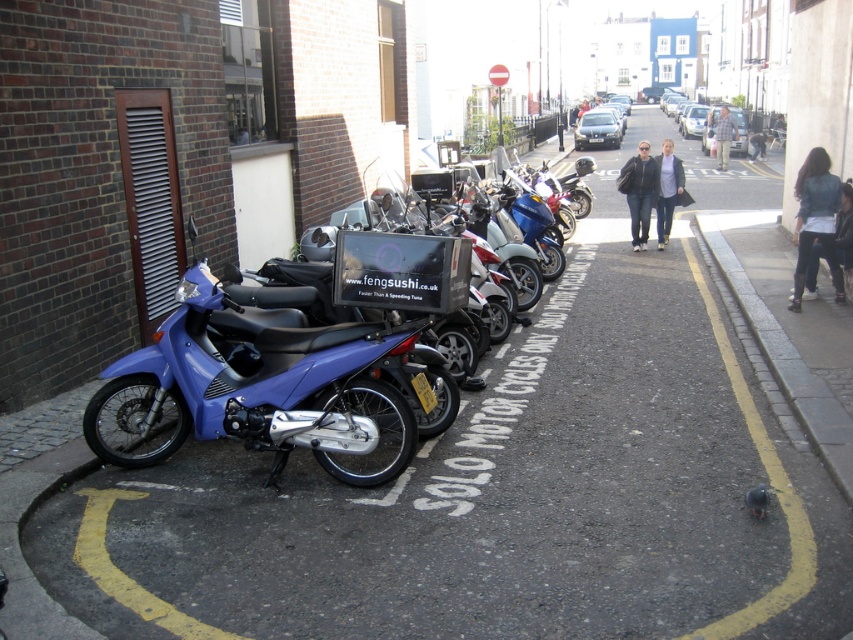
Who is positioned more to the left, matte blue motorcycle at left or gray concrete curb at lower right?

Positioned to the left is matte blue motorcycle at left.

Can you confirm if matte blue motorcycle at left is thinner than gray concrete curb at lower right?

In fact, matte blue motorcycle at left might be wider than gray concrete curb at lower right.

This screenshot has height=640, width=853. In order to click on matte blue motorcycle at left in this screenshot , I will do `click(265, 388)`.